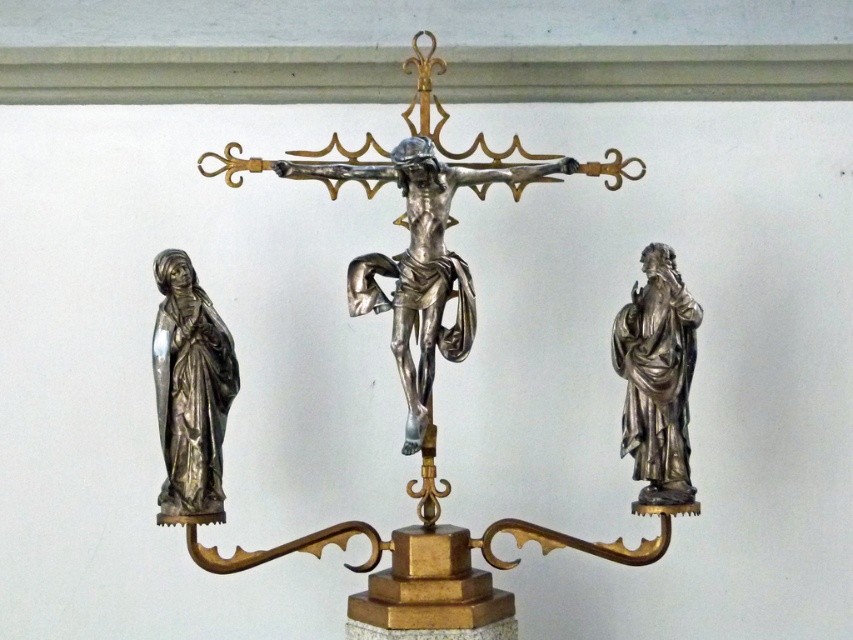
Is polished silver statue at left to the left of polished silver statue at right from the viewer's perspective?

Indeed, polished silver statue at left is positioned on the left side of polished silver statue at right.

Can you confirm if polished silver statue at left is positioned to the right of polished silver statue at right?

Incorrect, polished silver statue at left is not on the right side of polished silver statue at right.

Locate an element on the screen. The width and height of the screenshot is (853, 640). polished silver statue at left is located at coordinates (190, 388).

Identify the location of polished silver statue at left. (190, 388).